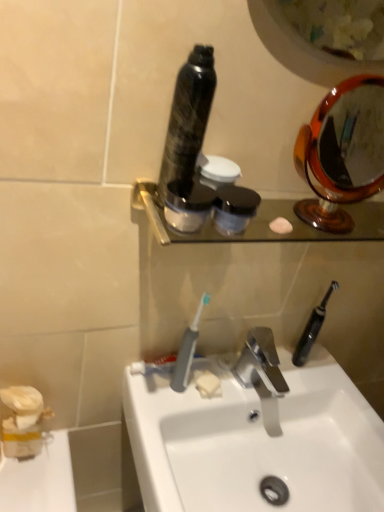
Question: Can you confirm if orange glass mirror at upper right is bigger than shiny black bottle at center, arranged as the 3th mouthwash when ordered from the bottom?

Choices:
 (A) no
 (B) yes

Answer: (B)

Question: From the image's perspective, is orange glass mirror at upper right below shiny black bottle at center, arranged as the 3th mouthwash when ordered from the bottom?

Choices:
 (A) no
 (B) yes

Answer: (B)

Question: Is orange glass mirror at upper right in contact with shiny black bottle at center, the 1th mouthwash positioned from the top?

Choices:
 (A) no
 (B) yes

Answer: (A)

Question: Does orange glass mirror at upper right come behind shiny black bottle at center, arranged as the 3th mouthwash when ordered from the bottom?

Choices:
 (A) yes
 (B) no

Answer: (A)

Question: Is orange glass mirror at upper right at the right side of shiny black bottle at center, arranged as the 3th mouthwash when ordered from the bottom?

Choices:
 (A) yes
 (B) no

Answer: (A)

Question: Is orange glass mirror at upper right facing away from shiny black bottle at center, arranged as the 3th mouthwash when ordered from the bottom?

Choices:
 (A) no
 (B) yes

Answer: (A)

Question: From the image's perspective, is polished chrome faucet at center below white matte soap at center?

Choices:
 (A) yes
 (B) no

Answer: (B)

Question: Does polished chrome faucet at center have a greater height compared to white matte soap at center?

Choices:
 (A) no
 (B) yes

Answer: (B)

Question: From a real-world perspective, is polished chrome faucet at center physically above white matte soap at center?

Choices:
 (A) no
 (B) yes

Answer: (B)

Question: Would you consider polished chrome faucet at center to be distant from white matte soap at center?

Choices:
 (A) yes
 (B) no

Answer: (B)

Question: Considering the relative sizes of polished chrome faucet at center and white matte soap at center in the image provided, is polished chrome faucet at center shorter than white matte soap at center?

Choices:
 (A) yes
 (B) no

Answer: (B)

Question: From a real-world perspective, is polished chrome faucet at center beneath white matte soap at center?

Choices:
 (A) no
 (B) yes

Answer: (A)

Question: Considering the relative sizes of polished chrome faucet at center and white glossy sink at center in the image provided, is polished chrome faucet at center wider than white glossy sink at center?

Choices:
 (A) no
 (B) yes

Answer: (A)